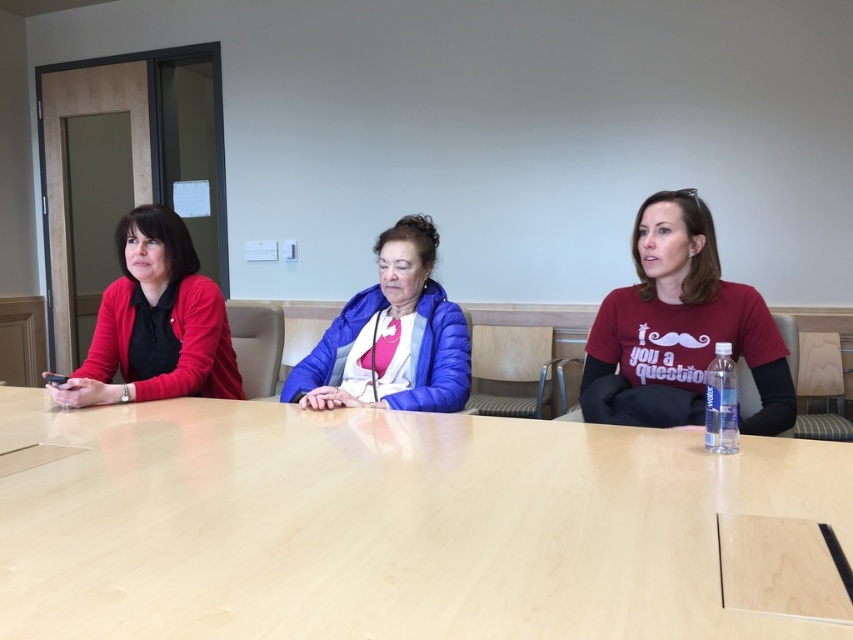
Where is `matte red t-shirt at right`? This screenshot has height=640, width=853. matte red t-shirt at right is located at coordinates (682, 323).

Which is behind, point (198, 618) or point (199, 358)?

Point (199, 358)

What do you see at coordinates (384, 524) in the screenshot?
I see `light wood table at center` at bounding box center [384, 524].

Which is behind, point (94, 449) or point (115, 340)?

Point (115, 340)

At what (x,y) coordinates should I click in order to perform the action: click on light wood table at center. Please return your answer as a coordinate pair (x, y). The height and width of the screenshot is (640, 853). Looking at the image, I should click on (384, 524).

Does matte red t-shirt at right come in front of matte red cardigan at left?

That is True.

Which is more to the right, matte red t-shirt at right or matte red cardigan at left?

matte red t-shirt at right

Between point (637, 275) and point (76, 385), which one is positioned behind?

Point (637, 275)

You are a GUI agent. You are given a task and a screenshot of the screen. Output one action in this format:
    pyautogui.click(x=<x>, y=<y>)
    Task: Click on the matte red t-shirt at right
    
    Given the screenshot: What is the action you would take?
    coord(682,323)